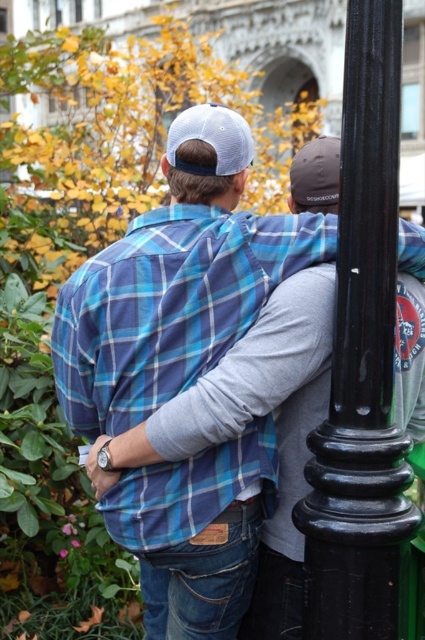
Does blue plaid shirt at center come in front of black glossy pole at right?

That is False.

Describe the element at coordinates (175, 282) in the screenshot. The height and width of the screenshot is (640, 425). I see `blue plaid shirt at center` at that location.

Identify the location of blue plaid shirt at center. This screenshot has width=425, height=640. (175, 282).